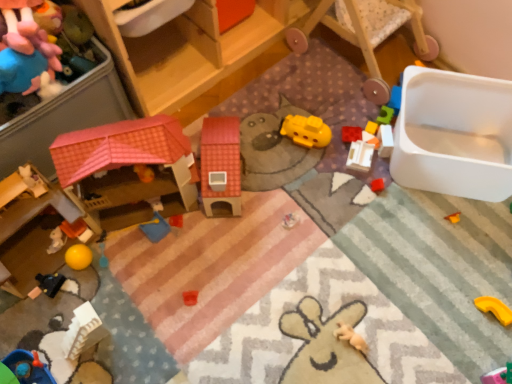
Locate an element on the screen. free space to the left of yellow matte submarine at center, which is the 5th toy in left-to-right order is located at coordinates (261, 139).